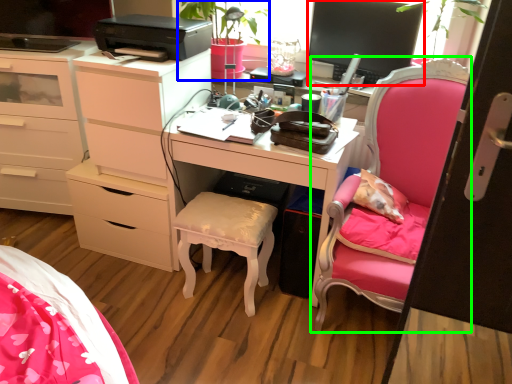
Question: Which object is positioned farthest from television (highlighted by a red box)? Select from houseplant (highlighted by a blue box) and chair (highlighted by a green box).

Choices:
 (A) houseplant
 (B) chair

Answer: (A)